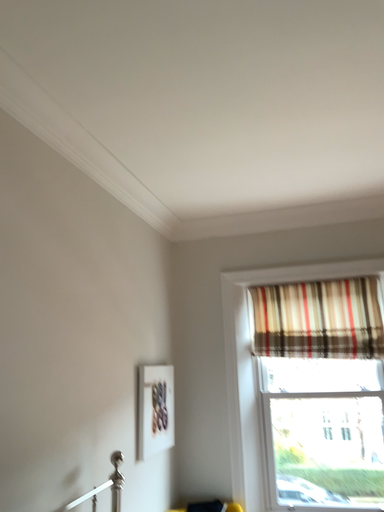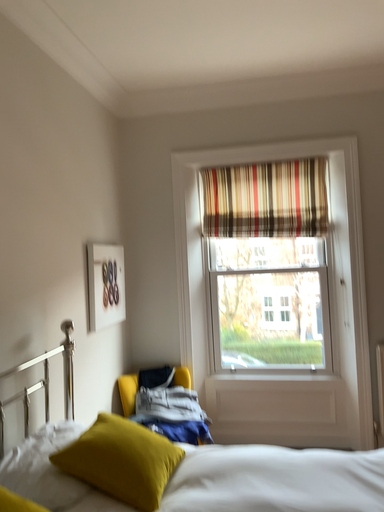
Question: How did the camera likely rotate when shooting the video?

Choices:
 (A) rotated upward
 (B) rotated downward

Answer: (B)